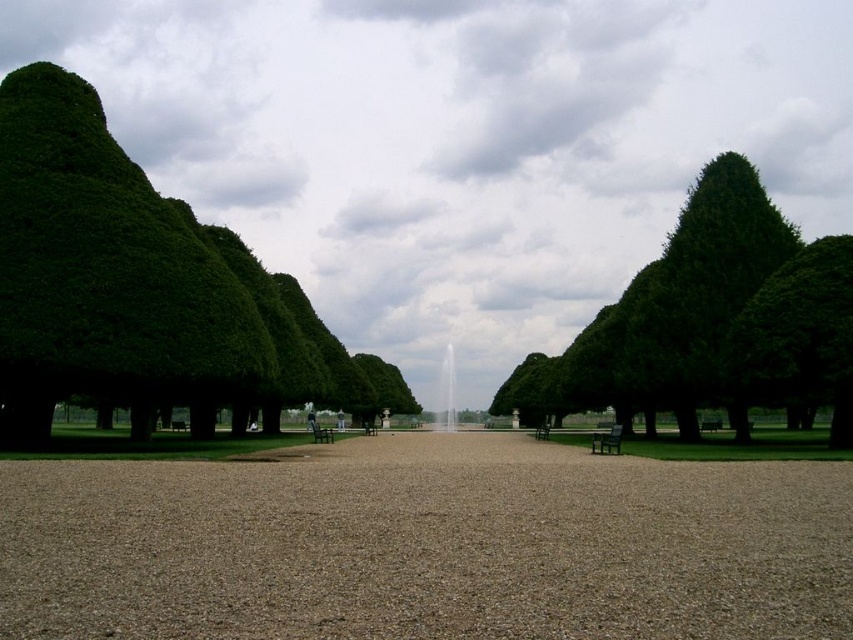
Question: Is green textured tree at right behind dark brown wooden bench at center?

Choices:
 (A) yes
 (B) no

Answer: (B)

Question: Among these objects, which one is farthest from the camera?

Choices:
 (A) brown gravel at center
 (B) dark gray wooden bench at center
 (C) green leafy tree at left
 (D) dark brown wooden bench at center

Answer: (B)

Question: Is brown gravel at center wider than dark brown wooden bench at center?

Choices:
 (A) no
 (B) yes

Answer: (B)

Question: Does green textured tree at right lie behind dark gray wooden bench at center?

Choices:
 (A) no
 (B) yes

Answer: (A)

Question: Which of these objects is positioned farthest from the dark brown wooden bench at center?

Choices:
 (A) dark gray wooden bench at center
 (B) brown gravel at center
 (C) green leafy tree at left
 (D) green textured tree at right

Answer: (C)

Question: Estimate the real-world distances between objects in this image. Which object is farther from the green textured tree at right?

Choices:
 (A) dark gray wooden bench at center
 (B) green leafy tree at left

Answer: (A)